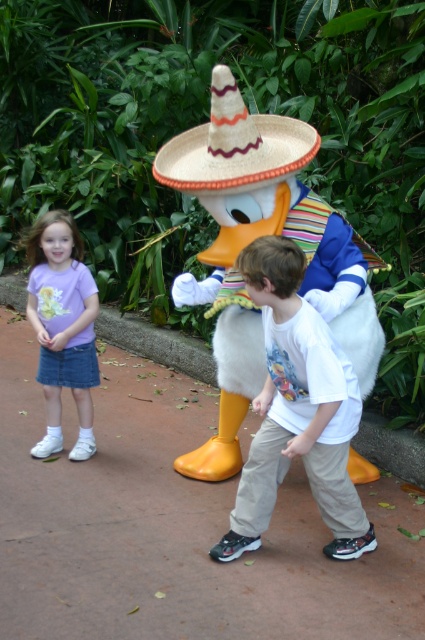
In the theme park scene, you see a white cotton shirt at center and a straw sombrero at center. Which object is positioned to the right of the other?

The white cotton shirt at center is to the right of the straw sombrero at center.

What is located at the point with coordinates (297, 410) in the image?

The white cotton shirt at center is located at point (297, 410).